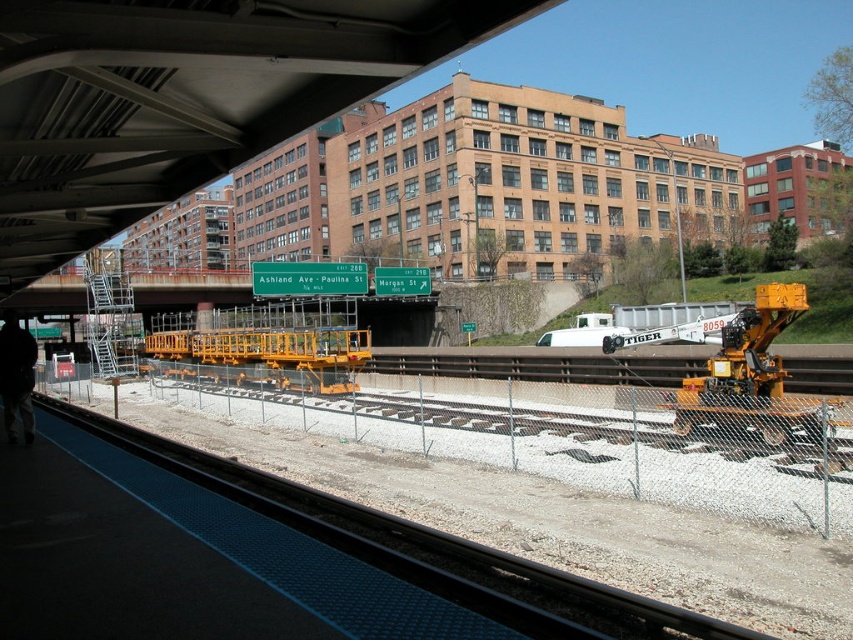
Is point (412, 548) farther from viewer compared to point (15, 356)?

That is False.

Does smooth concrete train track at lower center lie behind black fabric at lower left?

No, smooth concrete train track at lower center is closer to the viewer.

Describe the element at coordinates (409, 540) in the screenshot. Image resolution: width=853 pixels, height=640 pixels. I see `smooth concrete train track at lower center` at that location.

The image size is (853, 640). Identify the location of smooth concrete train track at lower center. (409, 540).

Can you confirm if yellow metallic crane at right is positioned to the right of black fabric at lower left?

Yes, yellow metallic crane at right is to the right of black fabric at lower left.

Is yellow metallic crane at right below black fabric at lower left?

Indeed, yellow metallic crane at right is positioned under black fabric at lower left.

Who is more forward, [747,369] or [3,369]?

Point [3,369]

Locate an element on the screen. yellow metallic crane at right is located at coordinates (753, 376).

Between point (213, 460) and point (720, 387), which one is positioned behind?

Point (720, 387)

Who is lower down, smooth concrete train track at lower center or yellow metallic crane at right?

smooth concrete train track at lower center is lower down.

Where is `smooth concrete train track at lower center`? smooth concrete train track at lower center is located at coordinates (409, 540).

The height and width of the screenshot is (640, 853). In order to click on smooth concrete train track at lower center in this screenshot , I will do `click(409, 540)`.